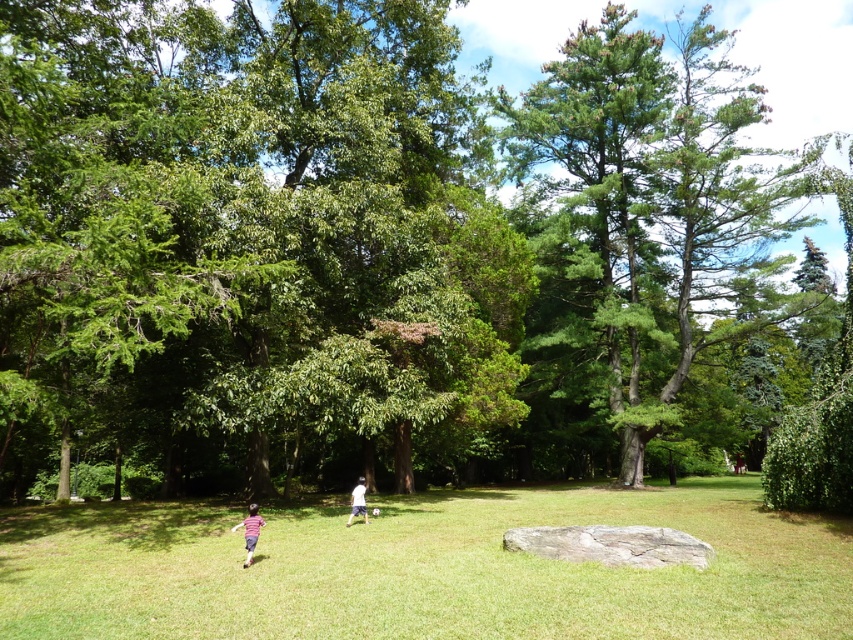
You are standing in the park and want to walk from the white cotton shirt at center to the green grassy field at center. Which direction should you move in?

You should move to the right to reach the green grassy field at center from the white cotton shirt at center since the green grassy field at center is located to the right of the white cotton shirt at center.